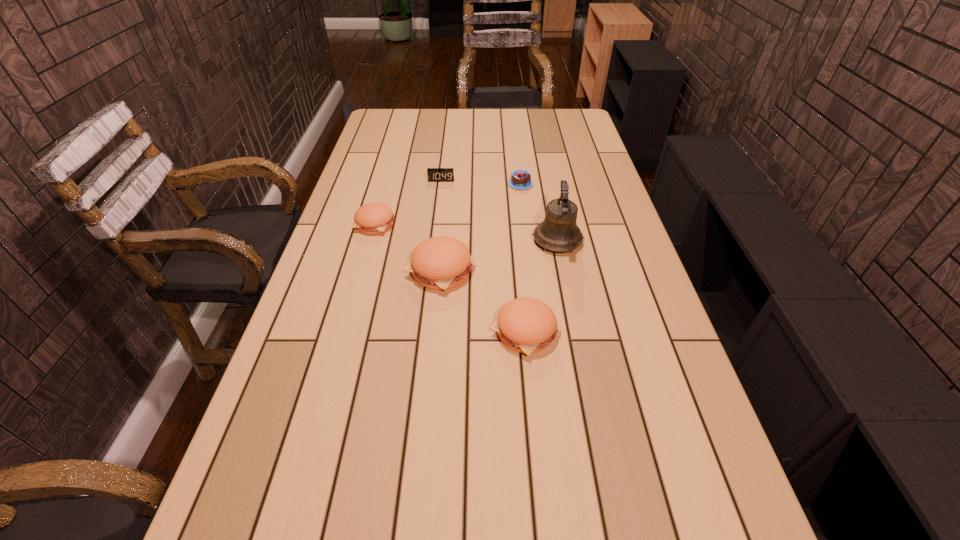
Where is `free region at the far left corner`? The image size is (960, 540). free region at the far left corner is located at coordinates (377, 113).

Find the location of a particular element. The image size is (960, 540). free space at the far right corner is located at coordinates (557, 130).

Locate an element on the screen. This screenshot has height=540, width=960. free space between the alarm clock and the second farthest patty is located at coordinates (441, 226).

This screenshot has height=540, width=960. What are the coordinates of `vacant region between the shortest patty and the tallest object` in the screenshot? It's located at (467, 232).

You are a GUI agent. You are given a task and a screenshot of the screen. Output one action in this format:
    pyautogui.click(x=<x>, y=<y>)
    Task: Click on the vacant region between the second patty from right to left and the tallest object
    
    Given the screenshot: What is the action you would take?
    pyautogui.click(x=499, y=255)

At what (x,y) coordinates should I click in order to perform the action: click on vacant point located between the chocolate cake and the tallest object. Please return your answer as a coordinate pair (x, y). Looking at the image, I should click on (539, 212).

The width and height of the screenshot is (960, 540). What are the coordinates of `vacant point located between the tallest object and the farthest patty` in the screenshot? It's located at (467, 232).

At what (x,y) coordinates should I click in order to perform the action: click on free space that is in between the second patty from right to left and the bell. Please return your answer as a coordinate pair (x, y). The image size is (960, 540). Looking at the image, I should click on click(499, 255).

Identify the location of free point between the tallest object and the second patty from right to left. Image resolution: width=960 pixels, height=540 pixels. (499, 255).

This screenshot has height=540, width=960. Identify the location of free space between the shortest patty and the second patty from right to left. (408, 247).